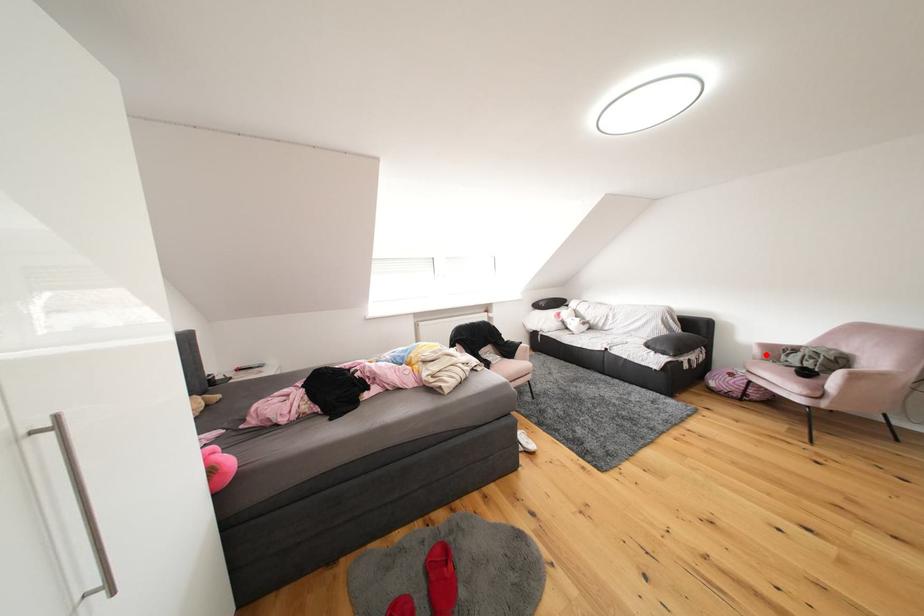
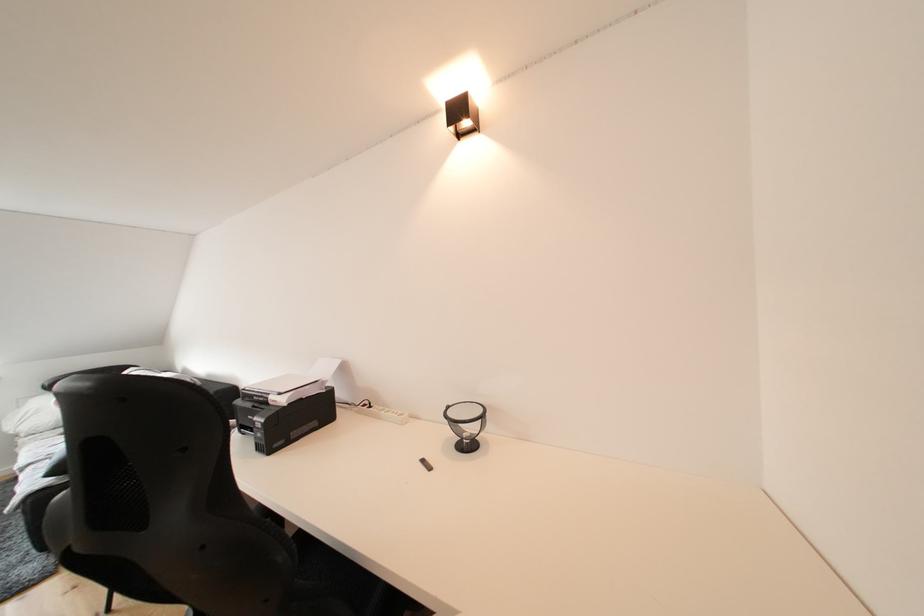
Question: I am providing you with two images of the same scene from different viewpoints. A red point is marked on the first image. At the location where the point appears in image 1, is it still visible in image 2?

Choices:
 (A) Yes
 (B) No

Answer: (B)